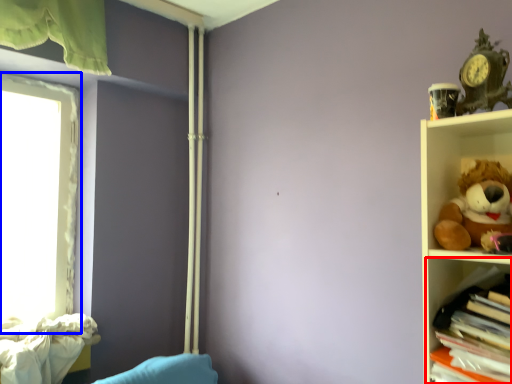
Question: Which object appears closest to the camera in this image, shelf (highlighted by a red box) or window (highlighted by a blue box)?

Choices:
 (A) shelf
 (B) window

Answer: (A)